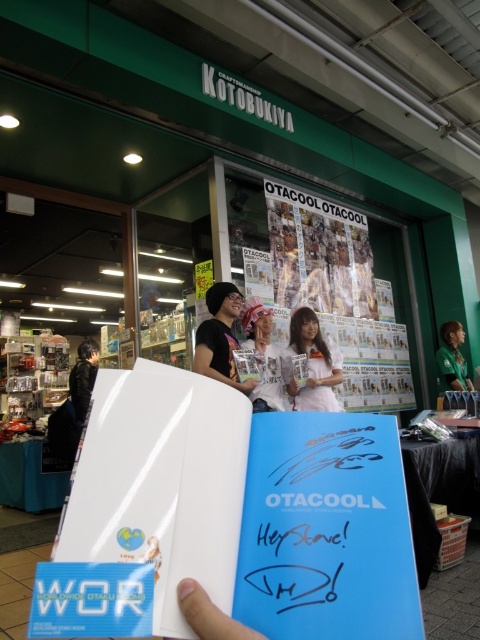
You are a delivery person who needs to place a package between the white paperboard at center and the black leather jacket at left. The package requires a space of 2 meters. Can you fit it there?

The white paperboard at center is 2.46 meters from the black leather jacket at left, so yes, the package requiring 2 meters of space can fit between them since the distance is sufficient.

You are holding a booklet with your right hand. The booklet has a blue cover with the text OTACOOL and a signature that says Hey Steve! You want to take a photo of the booklet using your phone camera. The camera is positioned at point [394,630]. Is the booklet in focus? Please answer based on the distance between the camera and the booklet.

The distance between the point [394,630] and the camera is 15.31 inches. Since the booklet is at this point, it is within the typical focus range of a phone camera, so the booklet should be in focus.